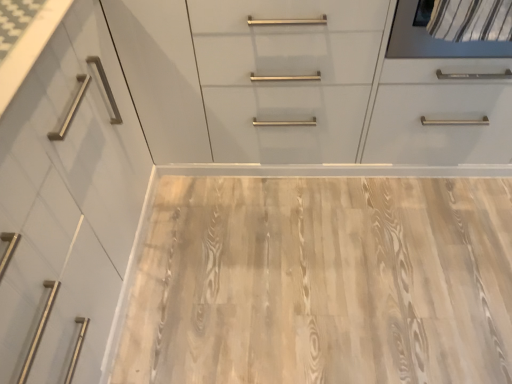
Question: In the image, is light wood/texture plywood at center positioned in front of or behind white glossy cabinet at upper center?

Choices:
 (A) behind
 (B) front

Answer: (A)

Question: Considering the positions of point (252, 198) and point (257, 145), is point (252, 198) closer or farther from the camera than point (257, 145)?

Choices:
 (A) closer
 (B) farther

Answer: (B)

Question: Considering the positions of light wood/texture plywood at center and white glossy cabinet at upper center in the image, is light wood/texture plywood at center bigger or smaller than white glossy cabinet at upper center?

Choices:
 (A) big
 (B) small

Answer: (B)

Question: Is white glossy cabinet at upper center bigger or smaller than light wood/texture plywood at center?

Choices:
 (A) big
 (B) small

Answer: (A)

Question: Relative to light wood/texture plywood at center, is white glossy cabinet at upper center in front or behind?

Choices:
 (A) front
 (B) behind

Answer: (A)

Question: From the image's perspective, relative to light wood/texture plywood at center, is white glossy cabinet at upper center above or below?

Choices:
 (A) below
 (B) above

Answer: (B)

Question: Is point (433, 147) positioned closer to the camera than point (294, 253)?

Choices:
 (A) farther
 (B) closer

Answer: (A)